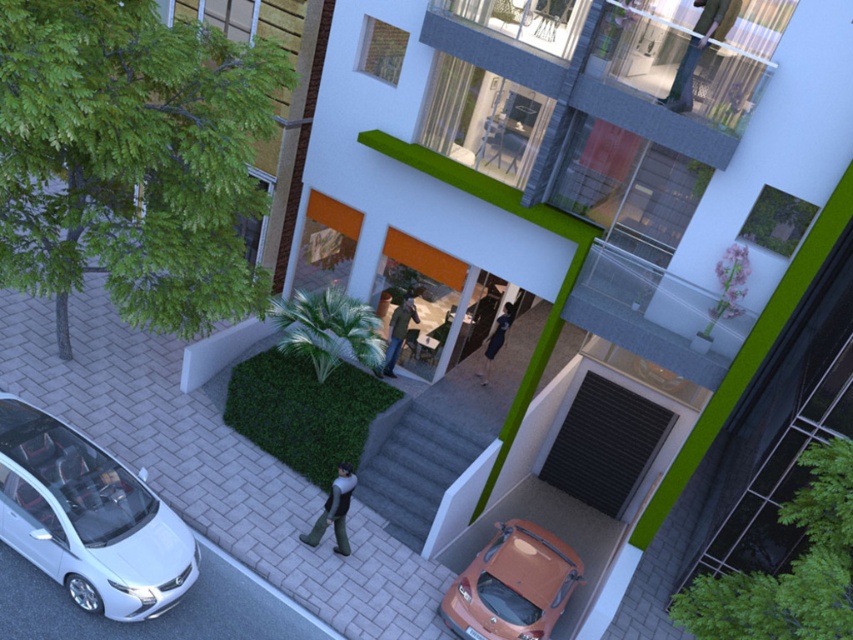
Does white glossy hatchback at lower left have a greater width compared to matte orange car at lower center?

Yes.

Can you confirm if white glossy hatchback at lower left is positioned below matte orange car at lower center?

Incorrect, white glossy hatchback at lower left is not positioned below matte orange car at lower center.

Is point (67, 531) farther from camera compared to point (457, 632)?

No.

Where is `white glossy hatchback at lower left`? This screenshot has width=853, height=640. white glossy hatchback at lower left is located at coordinates (88, 518).

In the scene shown: Does green fabric jacket at upper center have a greater height compared to dark gray fabric pants at lower center?

In fact, green fabric jacket at upper center may be shorter than dark gray fabric pants at lower center.

Does green fabric jacket at upper center come in front of dark gray fabric pants at lower center?

Yes, it is in front of dark gray fabric pants at lower center.

Where is `green fabric jacket at upper center`? The width and height of the screenshot is (853, 640). green fabric jacket at upper center is located at coordinates (695, 51).

Locate an element on the screen. green fabric jacket at upper center is located at coordinates (695, 51).

Locate an element on the screen. The height and width of the screenshot is (640, 853). matte orange car at lower center is located at coordinates (512, 586).

Who is more forward, (492, 547) or (401, 304)?

Point (492, 547) is more forward.

Find the location of `matte orange car at lower center`. matte orange car at lower center is located at coordinates (512, 586).